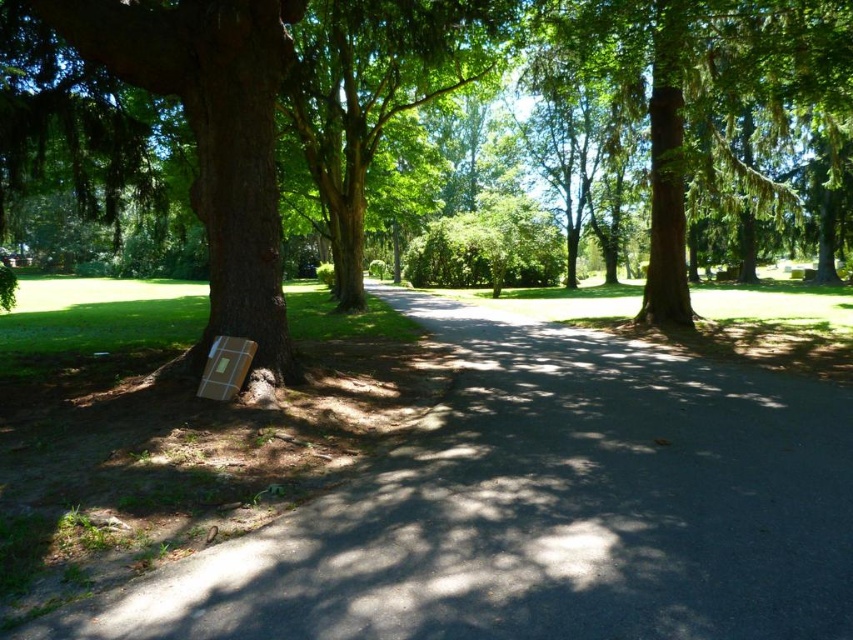
Question: Can you confirm if brown textured trunk at left is positioned above brown cardboard box at lower left?

Choices:
 (A) no
 (B) yes

Answer: (B)

Question: Which point is farther from the camera taking this photo?

Choices:
 (A) (416, 500)
 (B) (799, 12)
 (C) (155, 83)
 (D) (186, 16)

Answer: (B)

Question: Can you confirm if brown textured trunk at left is positioned below green textured tree at center?

Choices:
 (A) no
 (B) yes

Answer: (B)

Question: Among these objects, which one is farthest from the camera?

Choices:
 (A) brown cardboard box at left
 (B) green textured tree at center
 (C) brown cardboard box at lower left

Answer: (B)

Question: Is brown cardboard box at lower left further to camera compared to green textured tree at center?

Choices:
 (A) no
 (B) yes

Answer: (A)

Question: Among these points, which one is nearest to the camera?

Choices:
 (A) (496, 13)
 (B) (764, 12)
 (C) (285, 22)

Answer: (C)